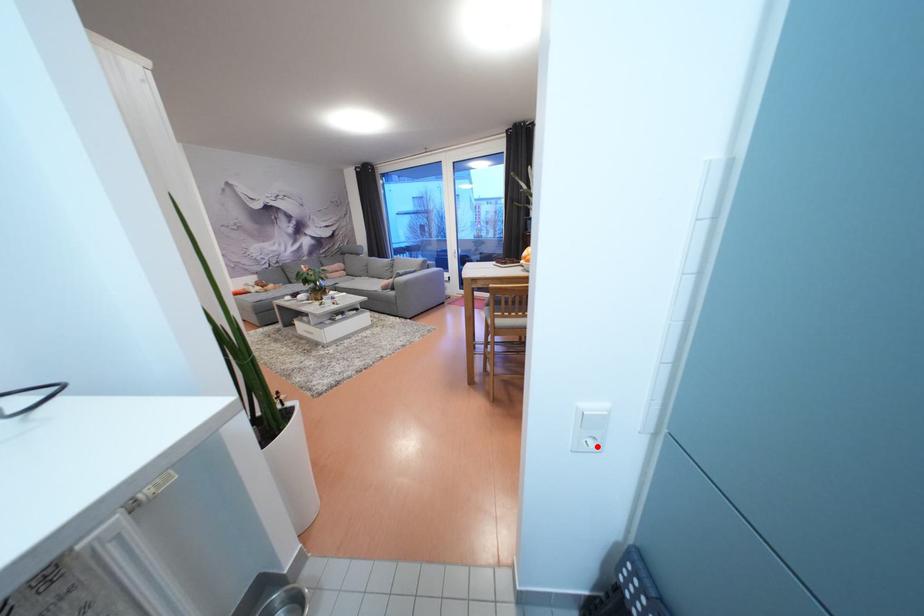
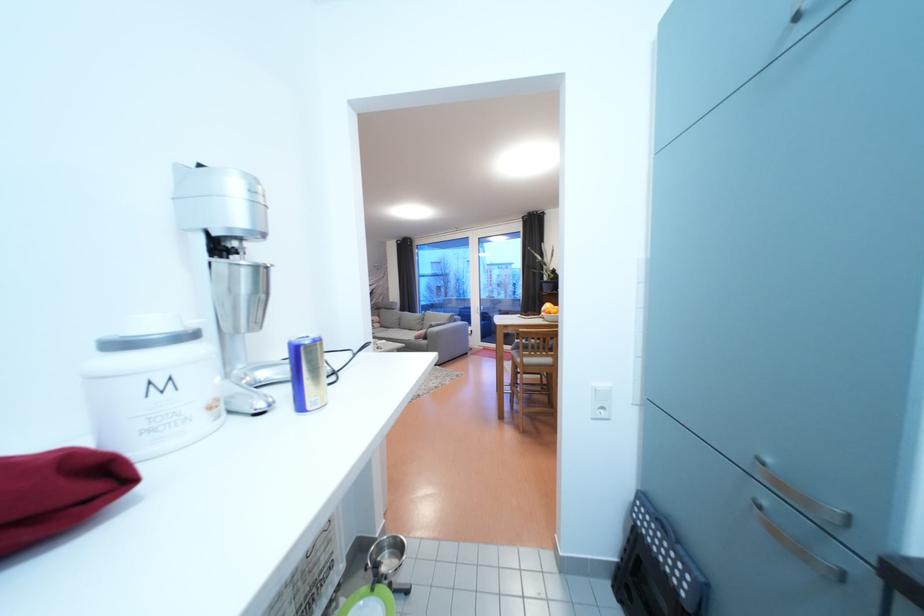
Find the pixel in the second image that matches the highlighted location in the first image.

(610, 416)